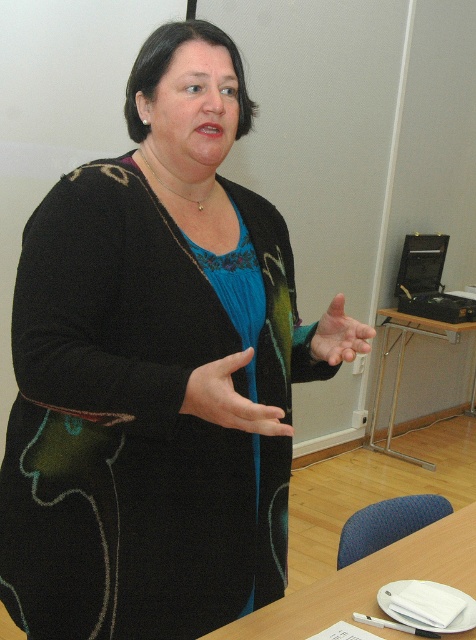
Can you confirm if matte black sweater at center is taller than transparent skin hand at center?

Correct, matte black sweater at center is much taller as transparent skin hand at center.

Measure the distance from matte black sweater at center to transparent skin hand at center.

matte black sweater at center and transparent skin hand at center are 11.68 inches apart.

The width and height of the screenshot is (476, 640). In order to click on matte black sweater at center in this screenshot , I will do `click(150, 371)`.

Locate an element on the screen. This screenshot has width=476, height=640. matte black sweater at center is located at coordinates (150, 371).

Between wooden table at center and transparent skin hand at center, which one is positioned lower?

wooden table at center

Image resolution: width=476 pixels, height=640 pixels. Find the location of `wooden table at center`. wooden table at center is located at coordinates (402, 365).

I want to click on wooden table at center, so coord(402,365).

From the picture: Can you confirm if wooden table at lower right is smaller than transparent skin hand at center?

Actually, wooden table at lower right might be larger than transparent skin hand at center.

Where is `wooden table at lower right`? The height and width of the screenshot is (640, 476). wooden table at lower right is located at coordinates (367, 582).